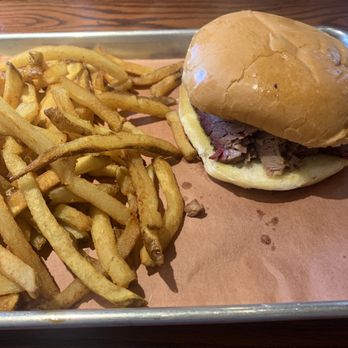
Where is `wood table`? Image resolution: width=348 pixels, height=348 pixels. wood table is located at coordinates (145, 21).